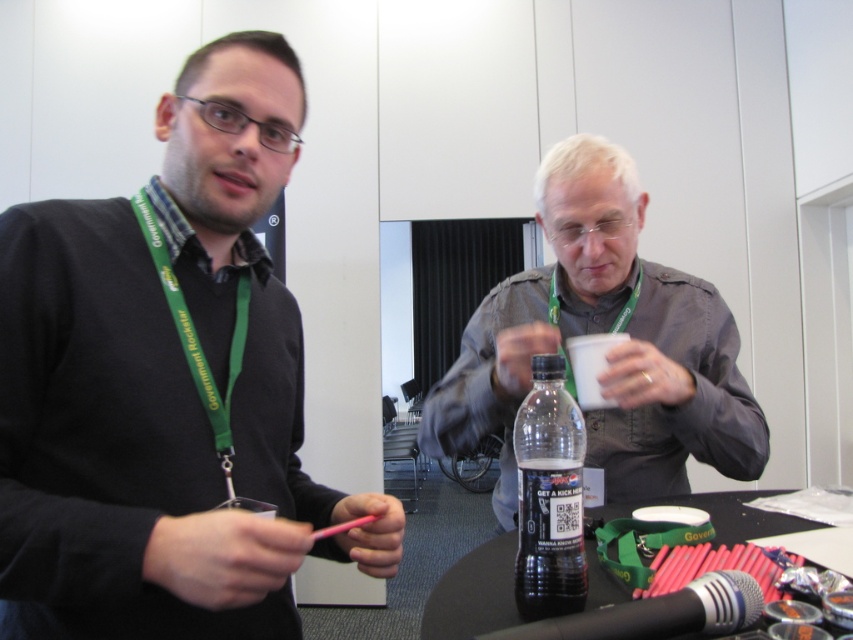
You are organizing a conference and need to place a label on the gray matte shirt at center and the black plastic bottle at center. Which object requires a larger label?

The gray matte shirt at center requires a larger label because it is bigger than the black plastic bottle at center.

You are a photographer at the event. You need to place a small decorative item at the exact center of the table. The clear plastic bottle at center is currently at point 0.777, 0.645. Is the bottle already at the center of the table?

The clear plastic bottle at center is located at point (549,497), which is not the exact center of the table. The exact center would be at point (426,320) in a normalized coordinate system, so the bottle is offset to the right and upper part of the table.